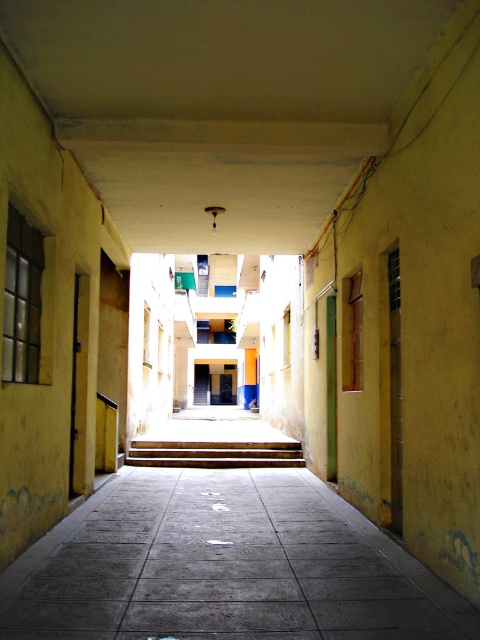
Who is taller, gray concrete pavement at center or wooden stairs at center?

wooden stairs at center

Can you confirm if gray concrete pavement at center is wider than wooden stairs at center?

Incorrect, gray concrete pavement at center's width does not surpass wooden stairs at center's.

Is point (346, 541) positioned after point (193, 465)?

No, (346, 541) is closer to viewer.

The width and height of the screenshot is (480, 640). What are the coordinates of `gray concrete pavement at center` in the screenshot? It's located at (224, 566).